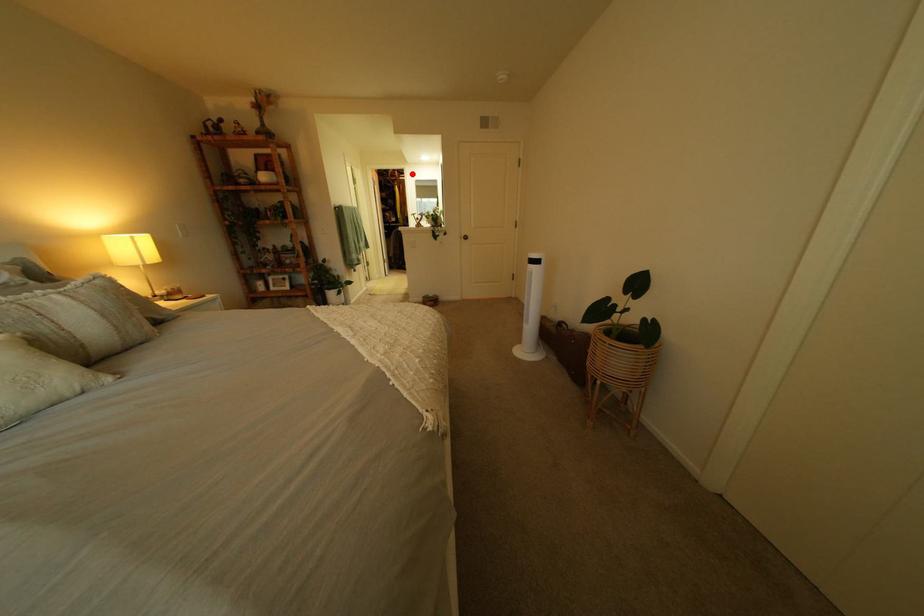
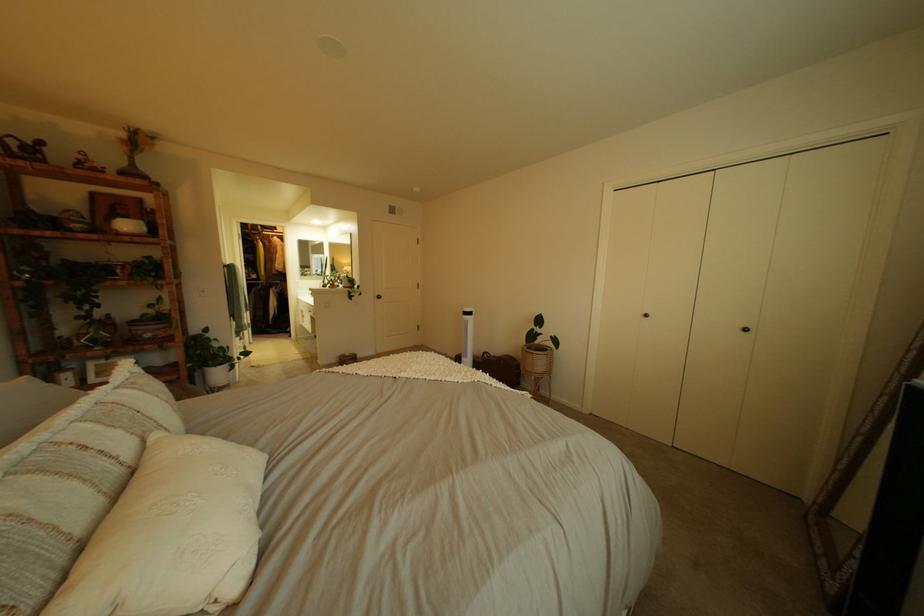
The point at the highlighted location is marked in the first image. Where is the corresponding point in the second image?

(274, 228)